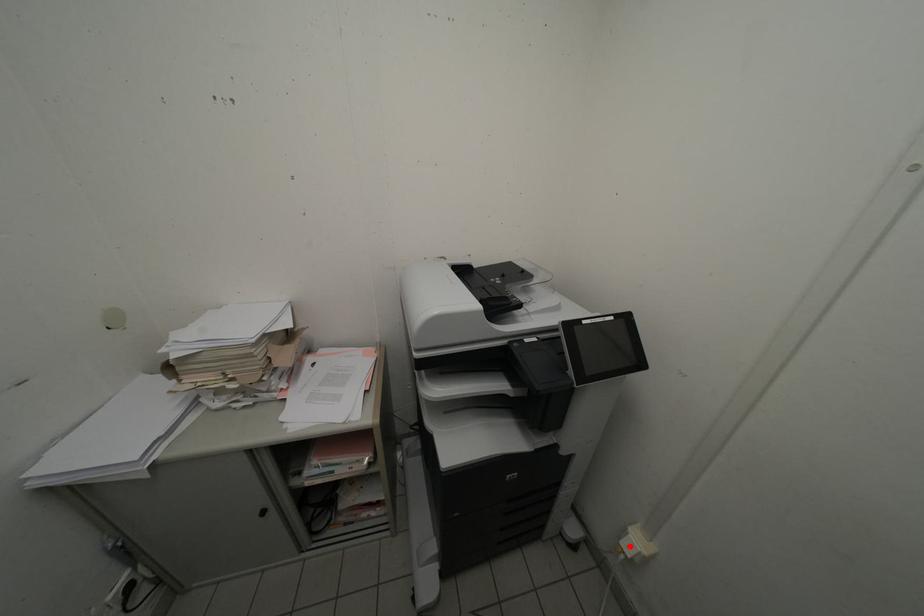
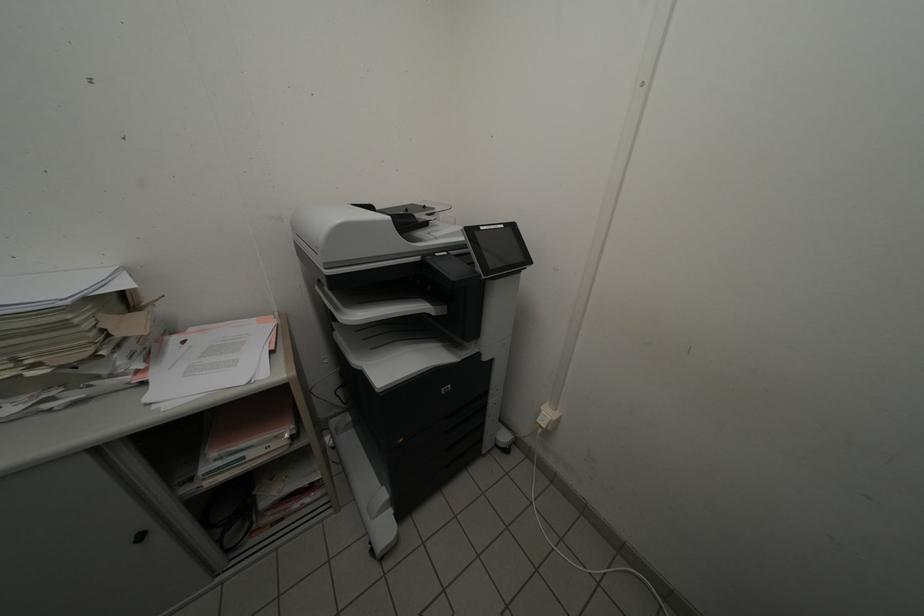
Question: A red point is marked in image1. In image2, is the corresponding 3D point closer to the camera or farther? Reply with the corresponding letter.

Choices:
 (A) The corresponding 3D point is closer.
 (B) The corresponding 3D point is farther.

Answer: (B)